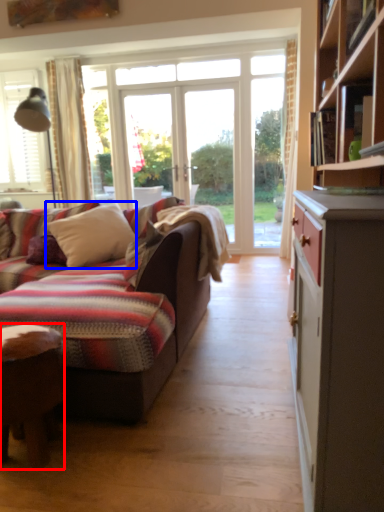
Question: Among these objects, which one is nearest to the camera, desk (highlighted by a red box) or pillow (highlighted by a blue box)?

Choices:
 (A) desk
 (B) pillow

Answer: (A)